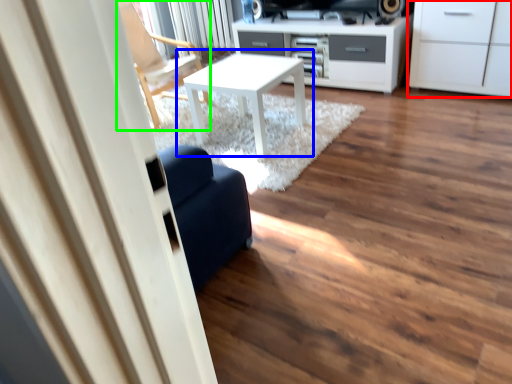
Question: Considering the real-world distances, which object is closest to cabinetry (highlighted by a red box)? table (highlighted by a blue box) or chair (highlighted by a green box).

Choices:
 (A) table
 (B) chair

Answer: (A)